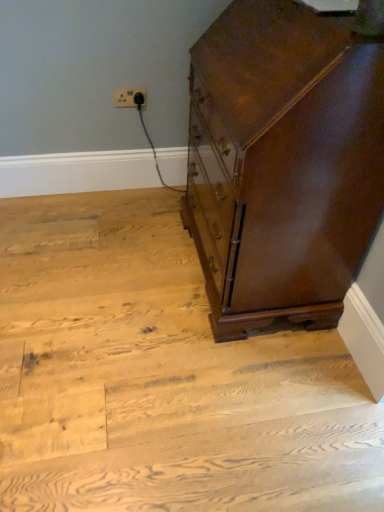
Question: Is white plastic outlet at upper center at the right side of wooden floor at center?

Choices:
 (A) yes
 (B) no

Answer: (B)

Question: Can you confirm if white plastic outlet at upper center is positioned to the left of wooden floor at center?

Choices:
 (A) yes
 (B) no

Answer: (A)

Question: Is the position of white plastic outlet at upper center more distant than that of wooden floor at center?

Choices:
 (A) yes
 (B) no

Answer: (A)

Question: From a real-world perspective, is white plastic outlet at upper center positioned over wooden floor at center based on gravity?

Choices:
 (A) no
 (B) yes

Answer: (B)

Question: Is white plastic outlet at upper center beside wooden floor at center?

Choices:
 (A) no
 (B) yes

Answer: (A)

Question: From the image's perspective, is white plastic outlet at upper center located beneath wooden floor at center?

Choices:
 (A) yes
 (B) no

Answer: (B)

Question: From a real-world perspective, is shiny brown wood chest of drawers at right positioned under wooden floor at center based on gravity?

Choices:
 (A) yes
 (B) no

Answer: (B)

Question: From the image's perspective, would you say shiny brown wood chest of drawers at right is shown under wooden floor at center?

Choices:
 (A) yes
 (B) no

Answer: (B)

Question: Is shiny brown wood chest of drawers at right positioned with its back to wooden floor at center?

Choices:
 (A) no
 (B) yes

Answer: (A)

Question: Does shiny brown wood chest of drawers at right turn towards wooden floor at center?

Choices:
 (A) no
 (B) yes

Answer: (B)

Question: Can you confirm if shiny brown wood chest of drawers at right is taller than wooden floor at center?

Choices:
 (A) yes
 (B) no

Answer: (A)

Question: Does shiny brown wood chest of drawers at right have a lesser width compared to wooden floor at center?

Choices:
 (A) yes
 (B) no

Answer: (A)

Question: Can we say shiny brown wood chest of drawers at right lies outside white plastic outlet at upper center?

Choices:
 (A) no
 (B) yes

Answer: (B)